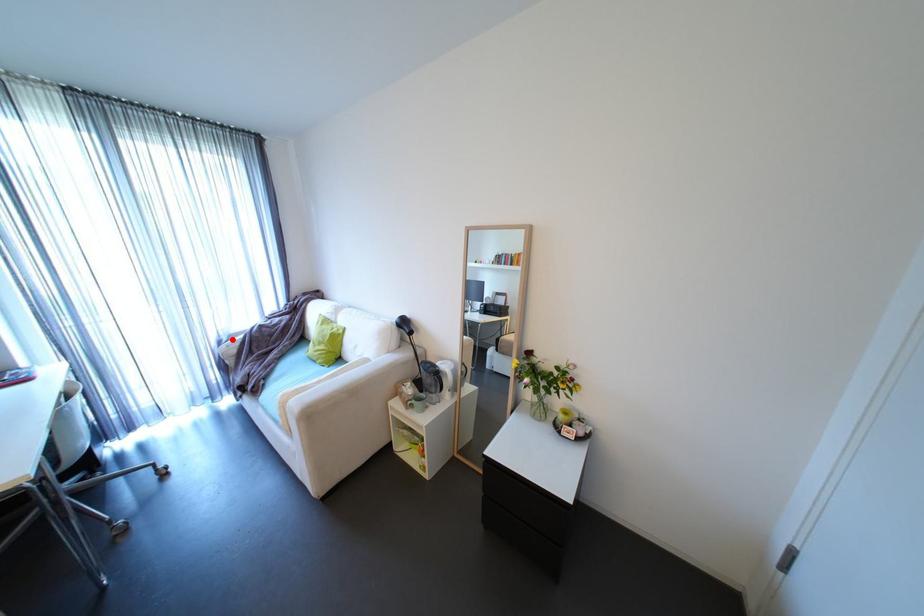
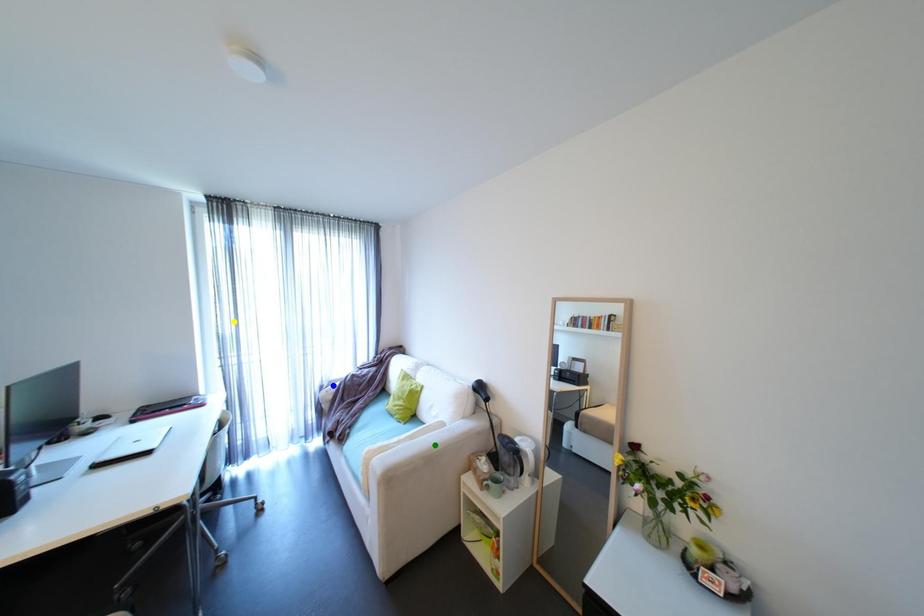
Question: I am providing you with two images of the same scene from different viewpoints. A red point is marked on the first image. You are given multiple points on the second image. Which mark in image 2 goes with the point in image 1?

Choices:
 (A) green point
 (B) blue point
 (C) yellow point

Answer: (B)